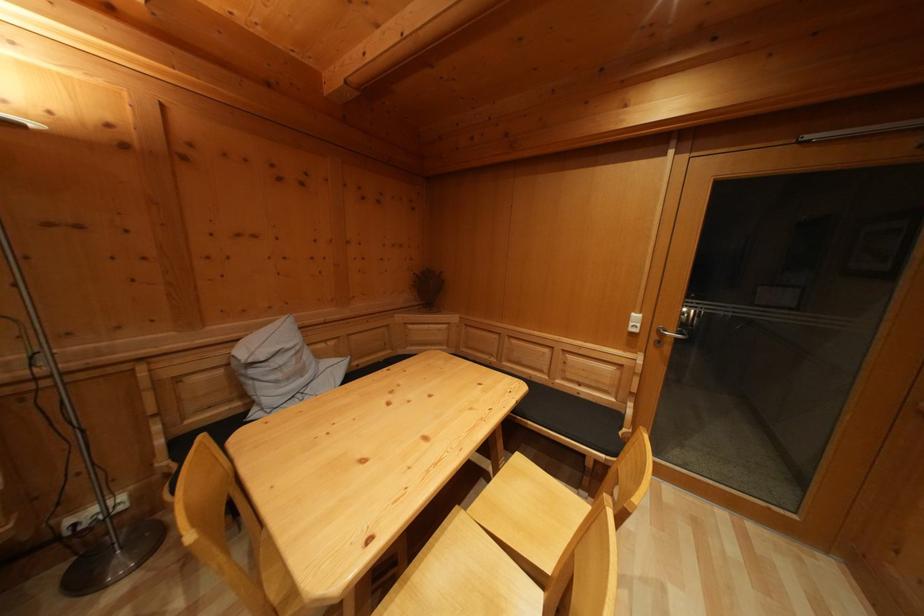
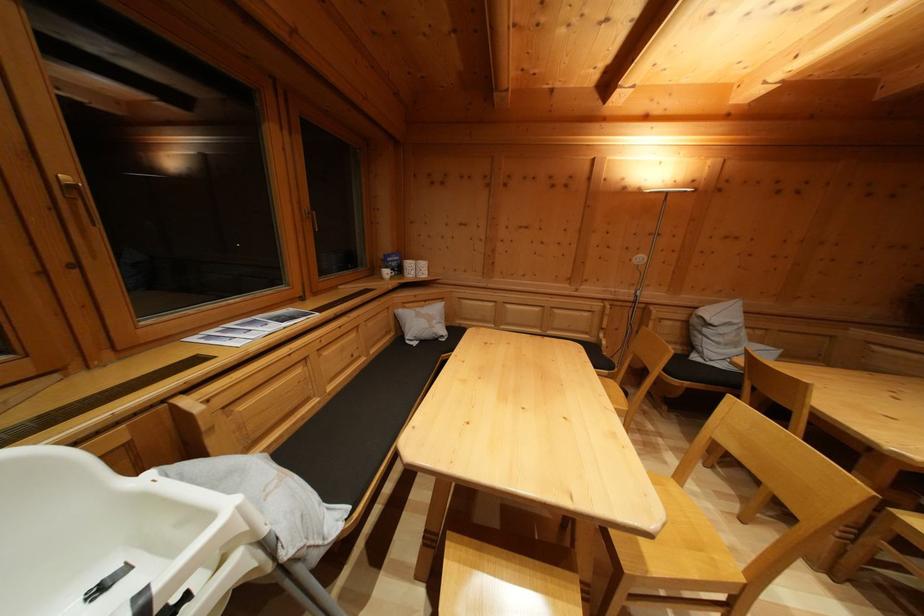
In the second image, find the point that corresponds to (258,379) in the first image.

(711, 337)